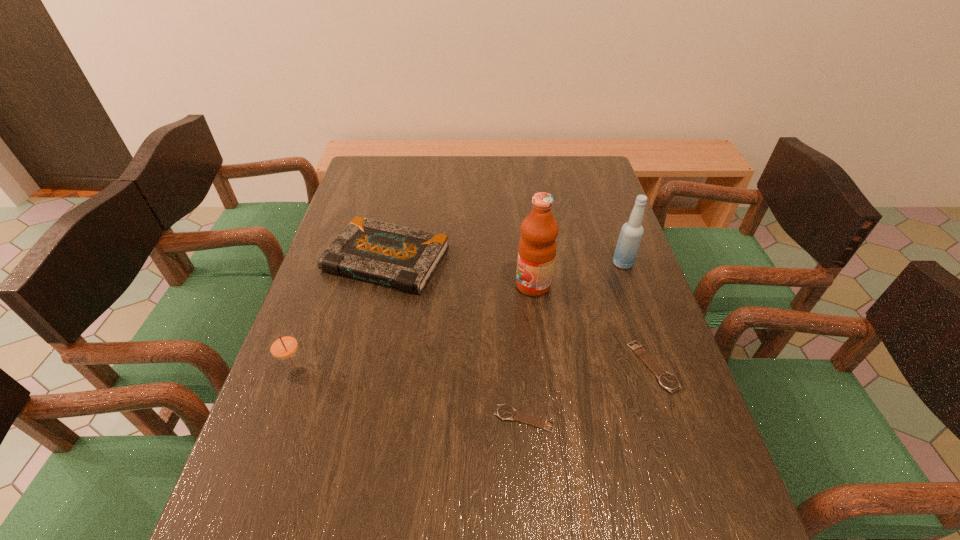
Locate an element on the screen. This screenshot has height=540, width=960. free space at the far edge is located at coordinates (537, 172).

The height and width of the screenshot is (540, 960). Find the location of `vacant region at the near edge of the desktop`. vacant region at the near edge of the desktop is located at coordinates (442, 453).

Find the location of a particular element. The image size is (960, 540). blank space at the left edge is located at coordinates (377, 211).

Identify the location of blank space at the right edge. (572, 223).

The image size is (960, 540). I want to click on vacant space at the far left corner of the desktop, so click(x=369, y=163).

Locate an element on the screen. vacant space at the far right corner of the desktop is located at coordinates (598, 162).

You are a GUI agent. You are given a task and a screenshot of the screen. Output one action in this format:
    pyautogui.click(x=<x>, y=<y>)
    Task: Click on the vacant area that lies between the fifth shortest object and the fruit juice
    Image resolution: width=960 pixels, height=540 pixels.
    Given the screenshot: What is the action you would take?
    [x=578, y=274]

Identify the location of free area in between the bottle and the shorter watch. (574, 341).

Identify the location of blank region between the third tallest object and the fruit juice. The height and width of the screenshot is (540, 960). 416,330.

Find the location of `empty space between the taller watch and the bottle`. empty space between the taller watch and the bottle is located at coordinates (637, 315).